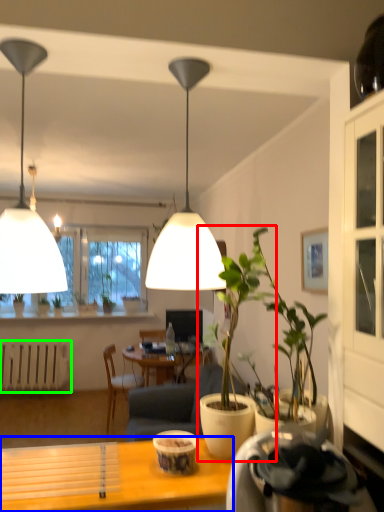
Question: Considering the real-world distances, which object is closest to houseplant (highlighted by a red box)? desk (highlighted by a blue box) or radiator (highlighted by a green box).

Choices:
 (A) desk
 (B) radiator

Answer: (A)